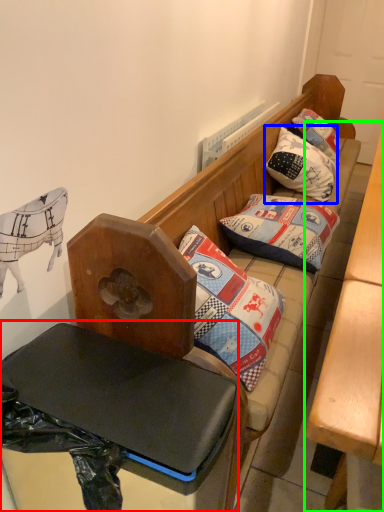
Question: Which object is the closest to the table (highlighted by a red box)? Choose among these: pillow (highlighted by a blue box) or table (highlighted by a green box).

Choices:
 (A) pillow
 (B) table

Answer: (B)